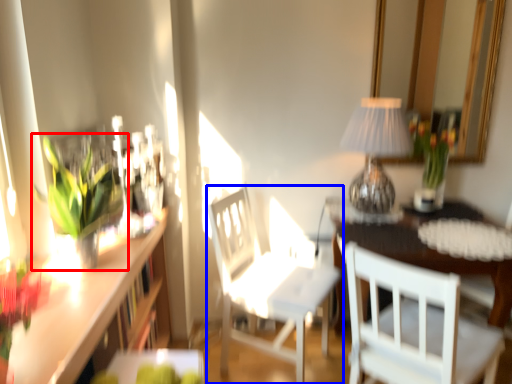
Question: Which point is closer to the camera, houseplant (highlighted by a red box) or chair (highlighted by a blue box)?

Choices:
 (A) houseplant
 (B) chair

Answer: (A)